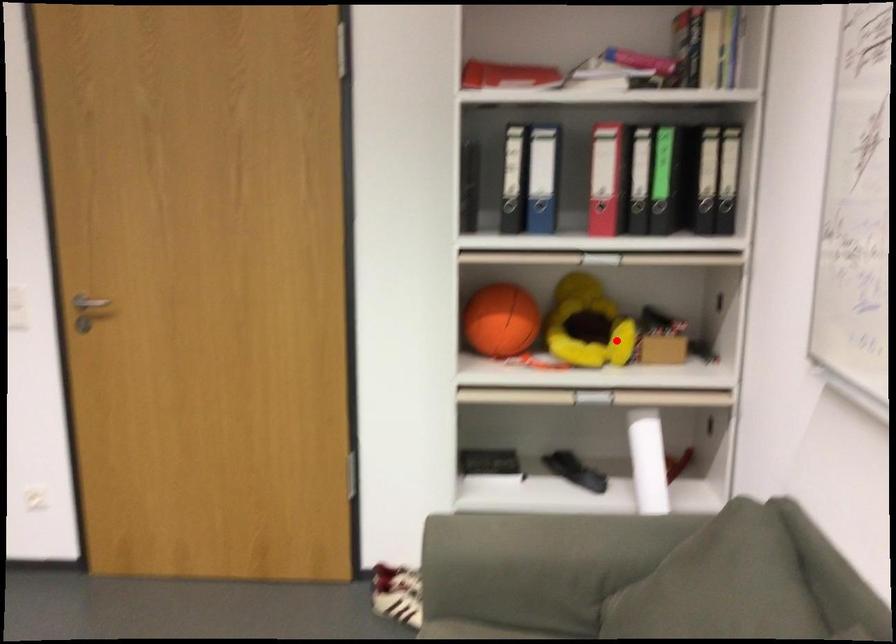
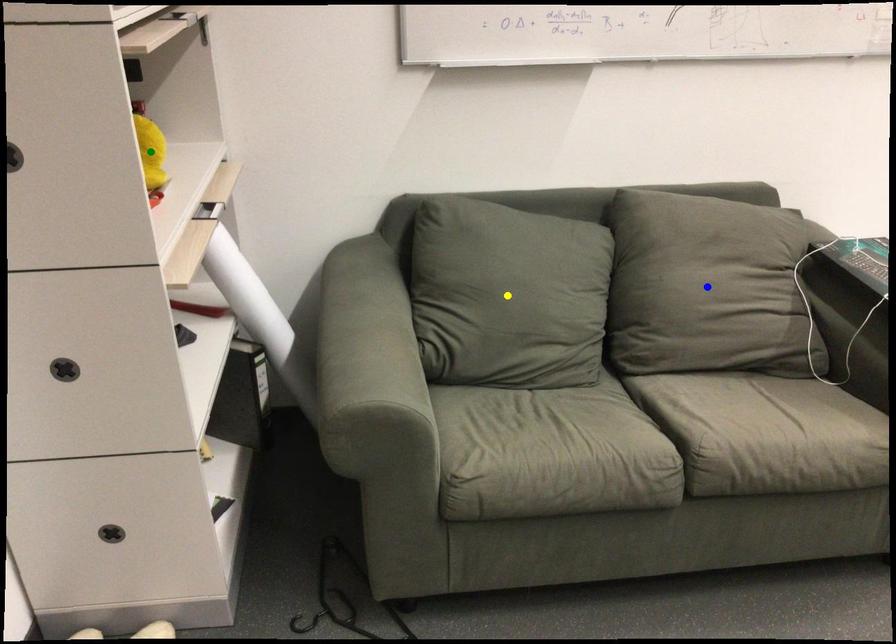
Question: I am providing you with two images of the same scene from different viewpoints. A red point is marked on the first image. You are given multiple points on the second image. In image 2, which mark is for the same physical point as the one in image 1?

Choices:
 (A) blue point
 (B) green point
 (C) yellow point

Answer: (B)